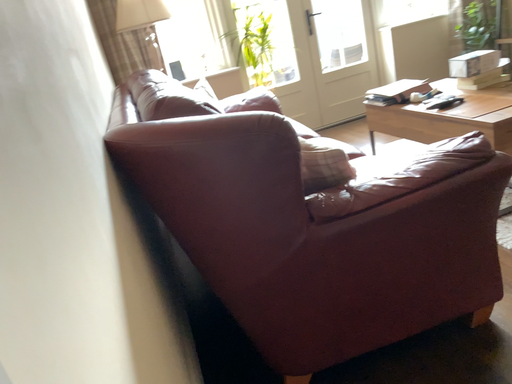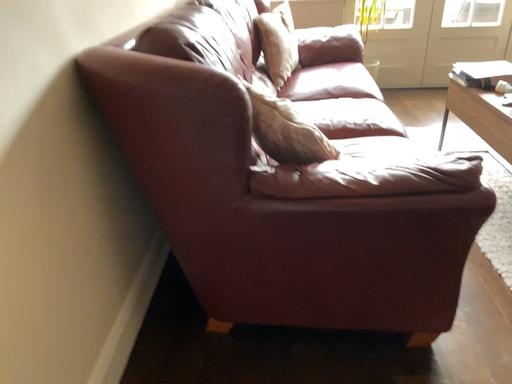
Question: How did the camera likely rotate when shooting the video?

Choices:
 (A) rotated downward
 (B) rotated upward

Answer: (A)